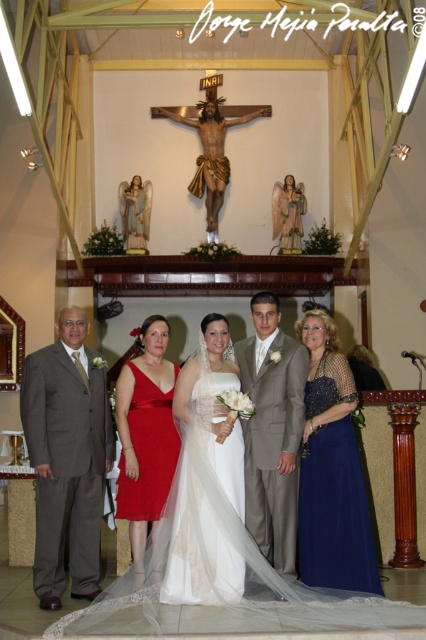
Question: Which object appears farthest from the camera in this image?

Choices:
 (A) matte red dress at center
 (B) matte gray suit at left
 (C) shiny blue dress at right
 (D) wooden crucifix at center

Answer: (D)

Question: Which object is positioned farthest from the light brown suit at center?

Choices:
 (A) white tulle dress at center
 (B) shiny blue dress at right
 (C) wooden crucifix at center

Answer: (C)

Question: Can you confirm if matte gray suit at left is positioned to the left of matte red dress at center?

Choices:
 (A) yes
 (B) no

Answer: (A)

Question: Which point is farther to the camera?

Choices:
 (A) (321, 529)
 (B) (167, 113)

Answer: (B)

Question: Considering the relative positions of matte gray suit at left and light brown suit at center in the image provided, where is matte gray suit at left located with respect to light brown suit at center?

Choices:
 (A) right
 (B) left

Answer: (B)

Question: Is white tulle dress at center below shiny blue dress at right?

Choices:
 (A) no
 (B) yes

Answer: (B)